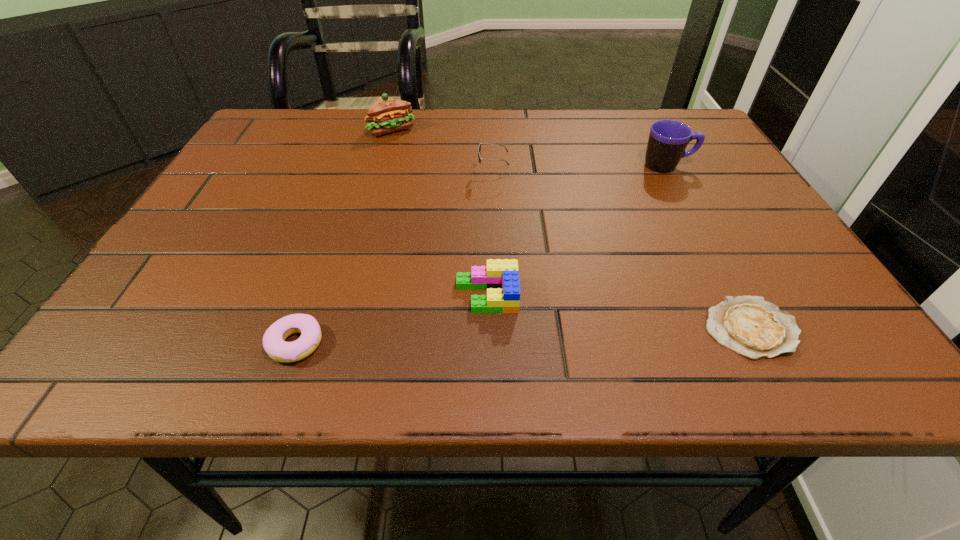
This screenshot has height=540, width=960. In order to click on free space located 0.050m on the back of the Lego in this screenshot , I will do `click(486, 260)`.

Locate an element on the screen. The height and width of the screenshot is (540, 960). blank space located on the right of the fifth tallest object is located at coordinates (368, 343).

Locate an element on the screen. The image size is (960, 540). vacant region located 0.340m on the left of the quiche is located at coordinates pyautogui.click(x=493, y=328).

I want to click on object that is at the far edge, so click(x=386, y=115).

You are a GUI agent. You are given a task and a screenshot of the screen. Output one action in this format:
    pyautogui.click(x=<x>, y=<y>)
    Task: Click on the doughnut that is at the near edge
    
    Given the screenshot: What is the action you would take?
    pyautogui.click(x=274, y=343)

Find the location of `quiche that is at the near edge`. quiche that is at the near edge is located at coordinates (752, 327).

Identify the location of mug situated at the right edge. The height and width of the screenshot is (540, 960). (668, 139).

Where is `quiche present at the right edge`? The height and width of the screenshot is (540, 960). quiche present at the right edge is located at coordinates (752, 327).

Image resolution: width=960 pixels, height=540 pixels. I want to click on object present at the near right corner, so click(x=752, y=327).

In the image, there is a desktop. Where is `blank space at the far edge`? blank space at the far edge is located at coordinates (345, 131).